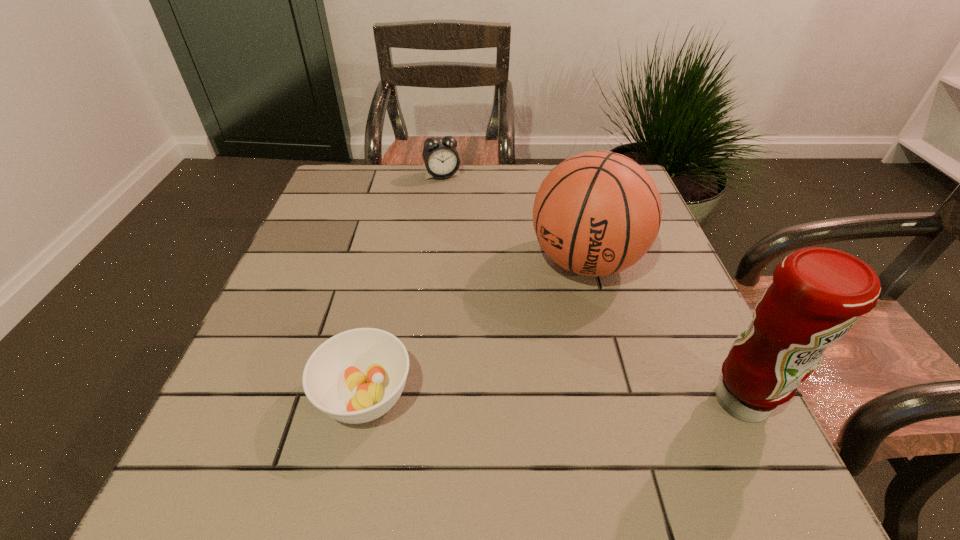
Where is `the shortest object`? This screenshot has height=540, width=960. the shortest object is located at coordinates click(356, 376).

Locate an element on the screen. The width and height of the screenshot is (960, 540). condiment is located at coordinates (817, 294).

Where is `the second farthest object`? the second farthest object is located at coordinates (597, 213).

Locate an element on the screen. basketball is located at coordinates click(x=597, y=213).

At what (x,y) coordinates should I click in order to perform the action: click on the third tallest object. Please return your answer as a coordinate pair (x, y). Looking at the image, I should click on (440, 156).

The image size is (960, 540). In order to click on alarm clock in this screenshot , I will do `click(440, 156)`.

Locate an element on the screen. vacant area located on the right of the soup bowl is located at coordinates (506, 396).

Where is `vacant space situated 0.280m on the back of the rightmost object`? The width and height of the screenshot is (960, 540). vacant space situated 0.280m on the back of the rightmost object is located at coordinates (677, 269).

Locate an element on the screen. This screenshot has width=960, height=540. vacant space positioned 0.310m on the surface of the basketball near the brand logo is located at coordinates (492, 408).

Where is `free point located 0.240m on the surface of the basketball near the brand logo`? The height and width of the screenshot is (540, 960). free point located 0.240m on the surface of the basketball near the brand logo is located at coordinates (512, 378).